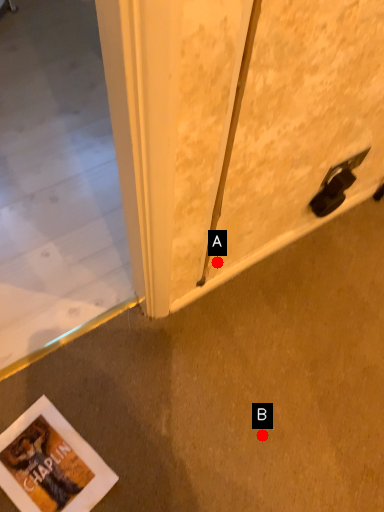
Question: Two points are circled on the image, labeled by A and B beside each circle. Among these points, which one is farthest from the camera?

Choices:
 (A) A is further
 (B) B is further

Answer: (A)